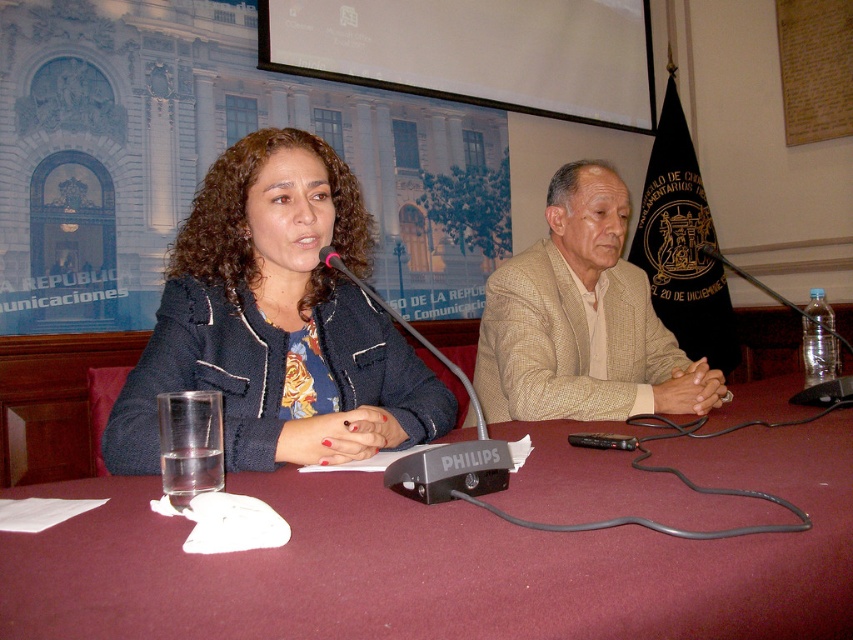
Question: Which object is positioned farthest from the maroon fabric table at center?

Choices:
 (A) matte black jacket at center
 (B) beige textured blazer at center

Answer: (B)

Question: Does maroon fabric table at center have a lesser width compared to matte black jacket at center?

Choices:
 (A) no
 (B) yes

Answer: (A)

Question: Which point is farther to the camera?

Choices:
 (A) (489, 296)
 (B) (340, 184)
 (C) (614, 534)

Answer: (A)

Question: Considering the real-world distances, which object is closest to the maroon fabric table at center?

Choices:
 (A) beige textured blazer at center
 (B) matte black jacket at center

Answer: (B)

Question: Is matte black jacket at center wider than beige textured blazer at center?

Choices:
 (A) no
 (B) yes

Answer: (A)

Question: Can you confirm if maroon fabric table at center is positioned to the left of matte black jacket at center?

Choices:
 (A) yes
 (B) no

Answer: (B)